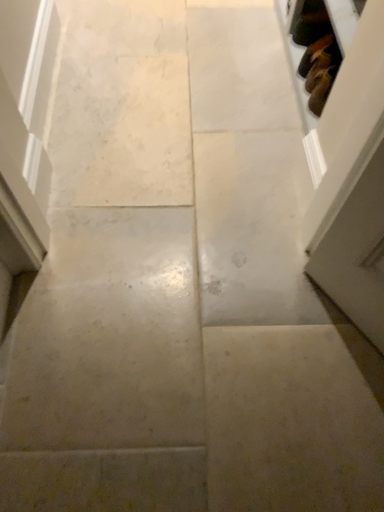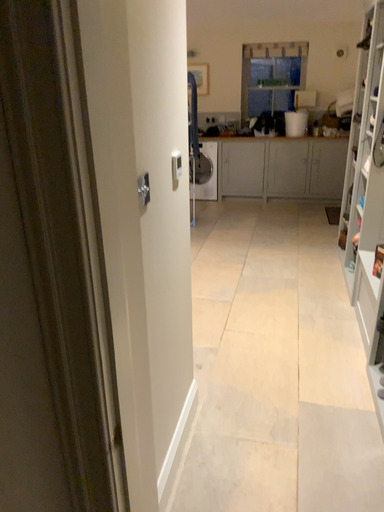
Question: Which way did the camera rotate in the video?

Choices:
 (A) rotated downward
 (B) rotated upward

Answer: (B)